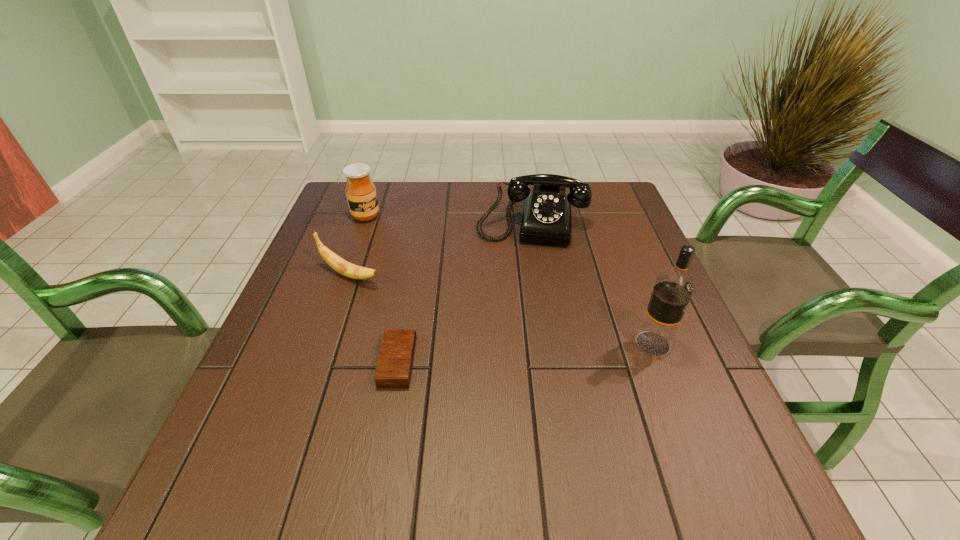
Where is `free spot at the near left corner of the desktop`? The height and width of the screenshot is (540, 960). free spot at the near left corner of the desktop is located at coordinates (273, 427).

This screenshot has width=960, height=540. In the image, there is a desktop. Identify the location of free space at the near right corner. (708, 416).

This screenshot has height=540, width=960. In order to click on unoccupied area between the fourth object from left to right and the banana in this screenshot , I will do `click(441, 248)`.

Locate an element on the screen. This screenshot has height=540, width=960. empty space between the alarm clock and the honey is located at coordinates click(x=382, y=289).

Where is `vacant region between the honey and the telephone`? vacant region between the honey and the telephone is located at coordinates (448, 219).

This screenshot has height=540, width=960. Find the location of `free spot between the third object from left to right and the fourth object from left to right`. free spot between the third object from left to right and the fourth object from left to right is located at coordinates (465, 291).

At what (x,y) coordinates should I click in order to perform the action: click on vacant area between the third nearest object and the honey. Please return your answer as a coordinate pair (x, y). The height and width of the screenshot is (540, 960). Looking at the image, I should click on (358, 246).

Locate an element on the screen. The image size is (960, 540). free spot between the rightmost object and the alarm clock is located at coordinates (525, 353).

This screenshot has width=960, height=540. Identify the location of free area in between the second shortest object and the rightmost object. (501, 309).

Locate an element on the screen. This screenshot has width=960, height=540. free space between the third farthest object and the honey is located at coordinates (358, 246).